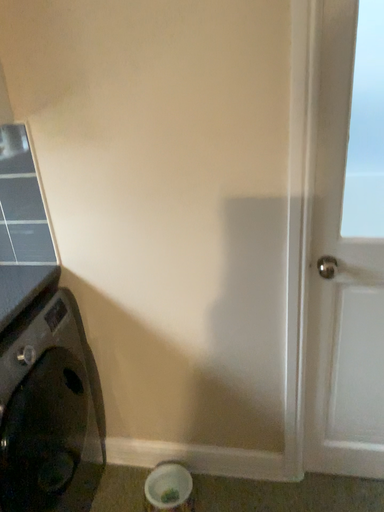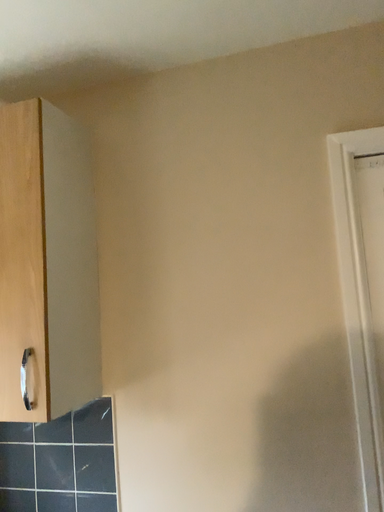
Question: How did the camera likely rotate when shooting the video?

Choices:
 (A) rotated downward
 (B) rotated upward

Answer: (B)